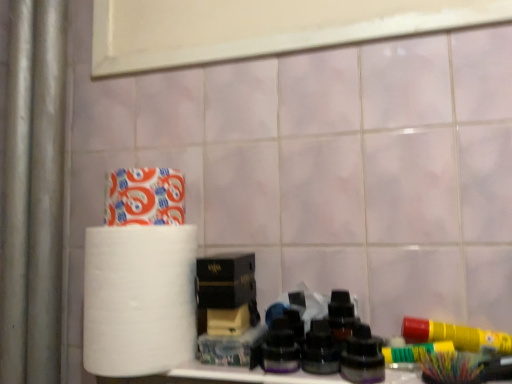
Question: Is black matte box at center taller or shorter than white matte paper towel at left?

Choices:
 (A) short
 (B) tall

Answer: (A)

Question: Relative to white matte paper towel at left, is black matte box at center in front or behind?

Choices:
 (A) behind
 (B) front

Answer: (A)

Question: Which object is positioned farthest from the black matte box at center?

Choices:
 (A) white matte toilet paper at upper left
 (B) white matte paper towel at left

Answer: (A)

Question: Based on their relative distances, which object is nearer to the white matte paper towel at left?

Choices:
 (A) black matte box at center
 (B) white matte toilet paper at upper left

Answer: (A)